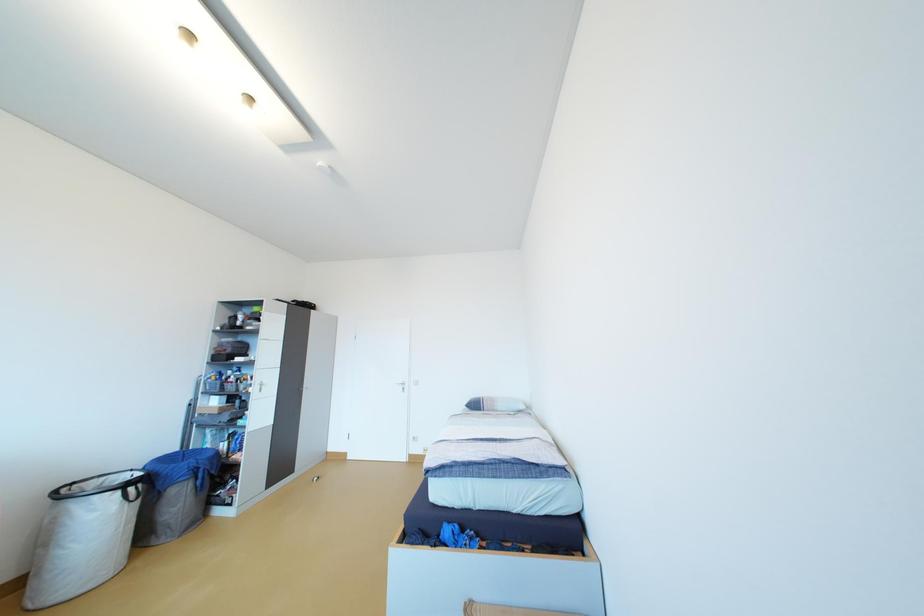
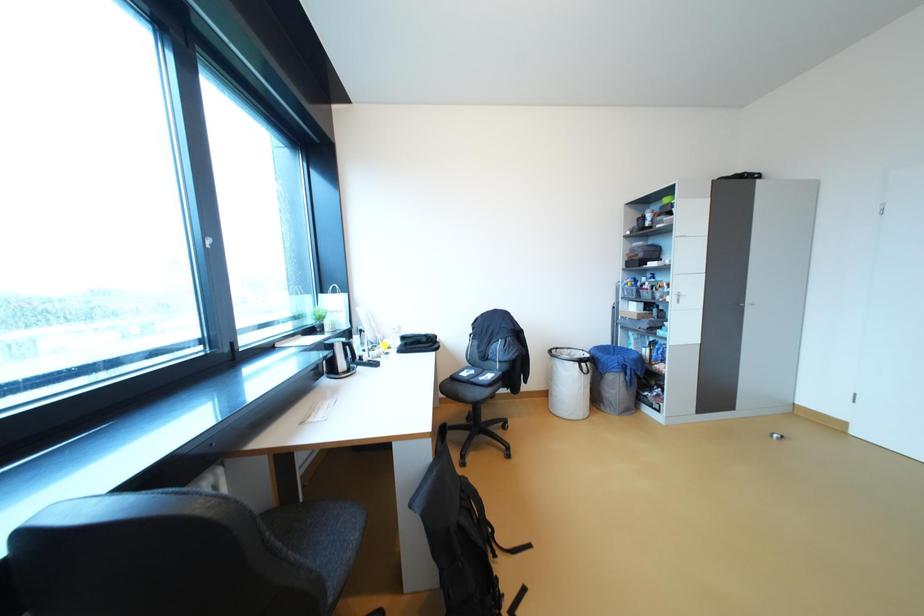
Question: The camera is either moving clockwise (left) or counter-clockwise (right) around the object. The first image is from the beginning of the video and the second image is from the end. Is the camera moving left or right when shooting the video?

Choices:
 (A) Left
 (B) Right

Answer: (B)